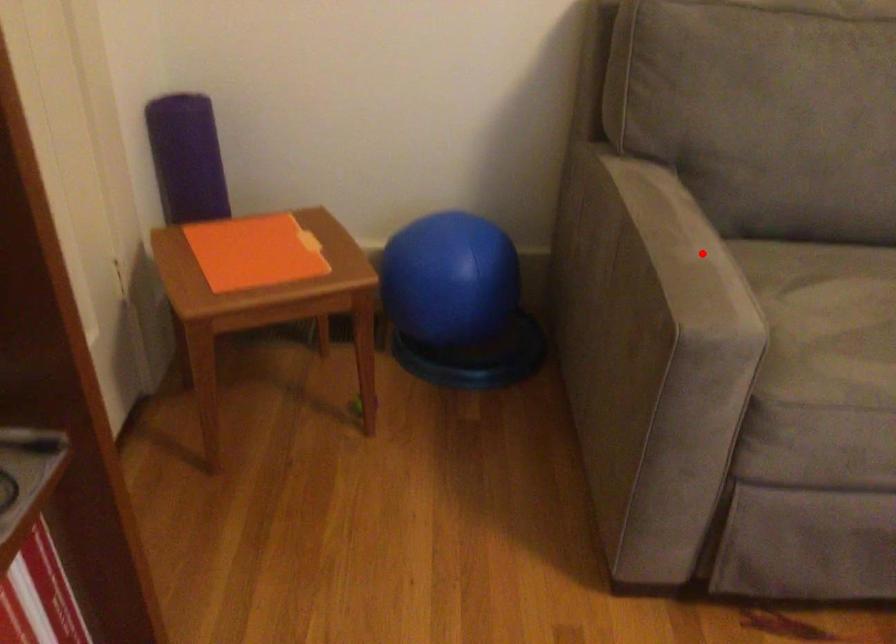
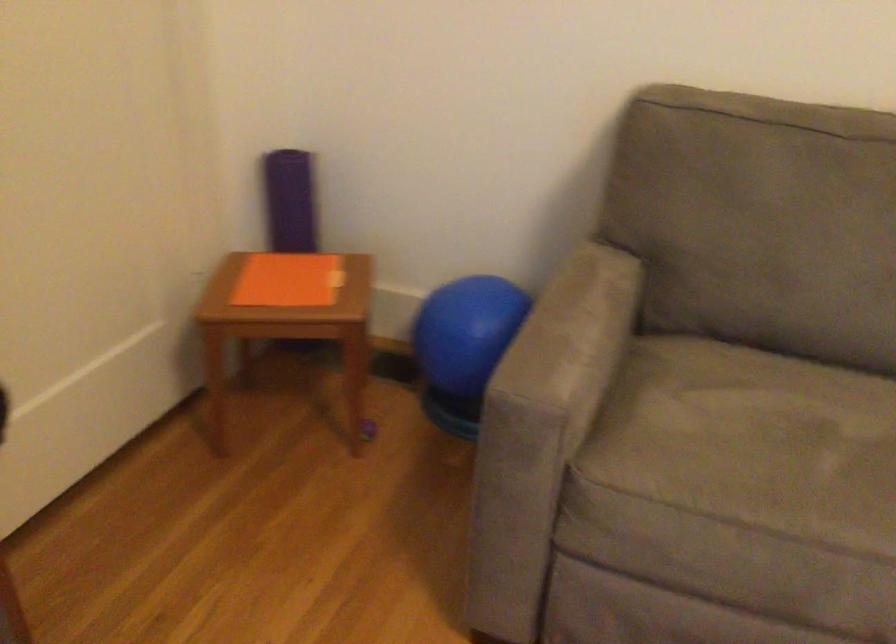
Find the pixel in the second image that matches the highlighted location in the first image.

(572, 333)